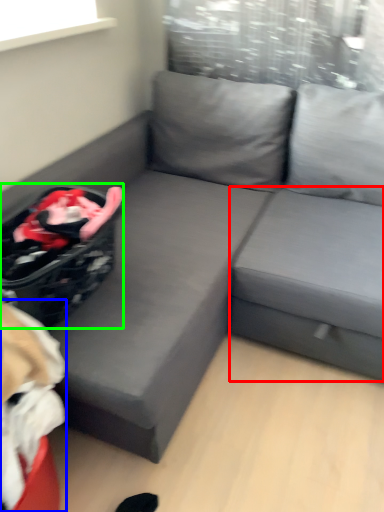
Question: Which is farther away from table (highlighted by a red box)? bean bag chair (highlighted by a blue box) or laundry basket (highlighted by a green box)?

Choices:
 (A) bean bag chair
 (B) laundry basket

Answer: (A)